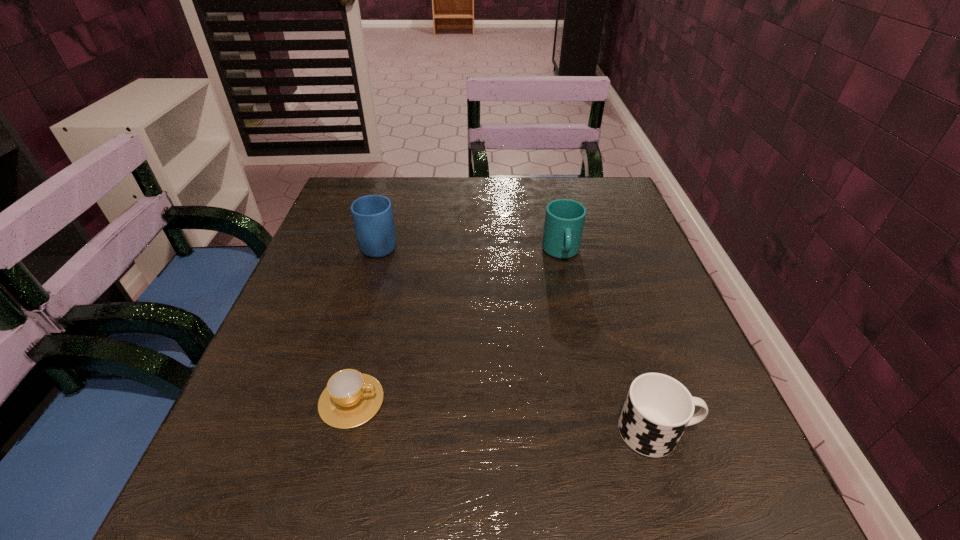
The height and width of the screenshot is (540, 960). I want to click on vacant space at the far right corner of the desktop, so click(595, 204).

Locate an element on the screen. vacant area that lies between the mug and the tallest cup is located at coordinates (470, 248).

Where is `free area in between the leftmost cup and the farthest cup`? free area in between the leftmost cup and the farthest cup is located at coordinates (456, 327).

This screenshot has height=540, width=960. In order to click on vacant area that lies between the leftmost cup and the tallest cup in this screenshot , I will do `click(456, 327)`.

The height and width of the screenshot is (540, 960). In order to click on vacant point located between the farthest cup and the shortest object in this screenshot , I will do `click(456, 327)`.

The width and height of the screenshot is (960, 540). What are the coordinates of `vacant point located between the second shortest cup and the shortest cup` in the screenshot? It's located at (504, 416).

The image size is (960, 540). I want to click on blank region between the shortest cup and the farthest cup, so click(x=456, y=327).

Find the location of a particular element. The image size is (960, 540). unoccupied position between the second shortest object and the mug is located at coordinates (518, 338).

This screenshot has width=960, height=540. In order to click on blank region between the mug and the tallest cup in this screenshot , I will do `click(470, 248)`.

The width and height of the screenshot is (960, 540). Find the location of `free area in between the second shortest cup and the leftmost cup`. free area in between the second shortest cup and the leftmost cup is located at coordinates (504, 416).